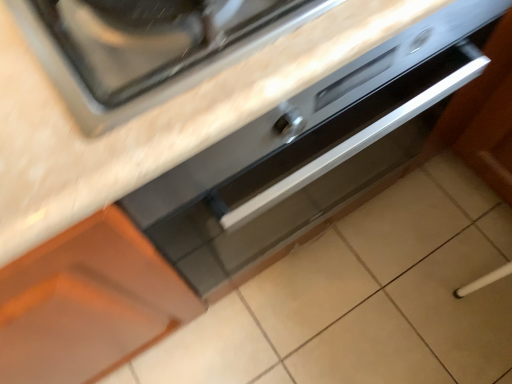
Find the location of `free space to the back side of beige ceramic tile at lower right`. free space to the back side of beige ceramic tile at lower right is located at coordinates (440, 232).